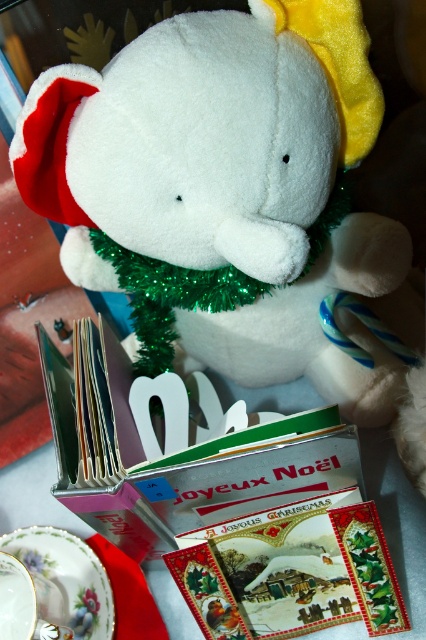
Can you confirm if white plush toy at center is positioned to the left of porcelain floral saucer at lower left?

Incorrect, white plush toy at center is not on the left side of porcelain floral saucer at lower left.

Is white plush toy at center positioned at the back of porcelain floral saucer at lower left?

That is False.

What do you see at coordinates (229, 188) in the screenshot? Image resolution: width=426 pixels, height=640 pixels. I see `white plush toy at center` at bounding box center [229, 188].

Where is `white plush toy at center`? The width and height of the screenshot is (426, 640). white plush toy at center is located at coordinates (229, 188).